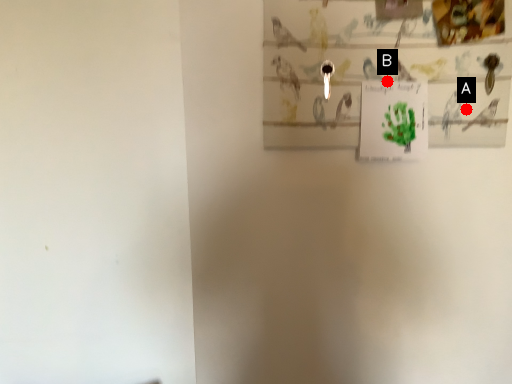
Question: Two points are circled on the image, labeled by A and B beside each circle. Which point is further to the camera?

Choices:
 (A) A is further
 (B) B is further

Answer: (A)